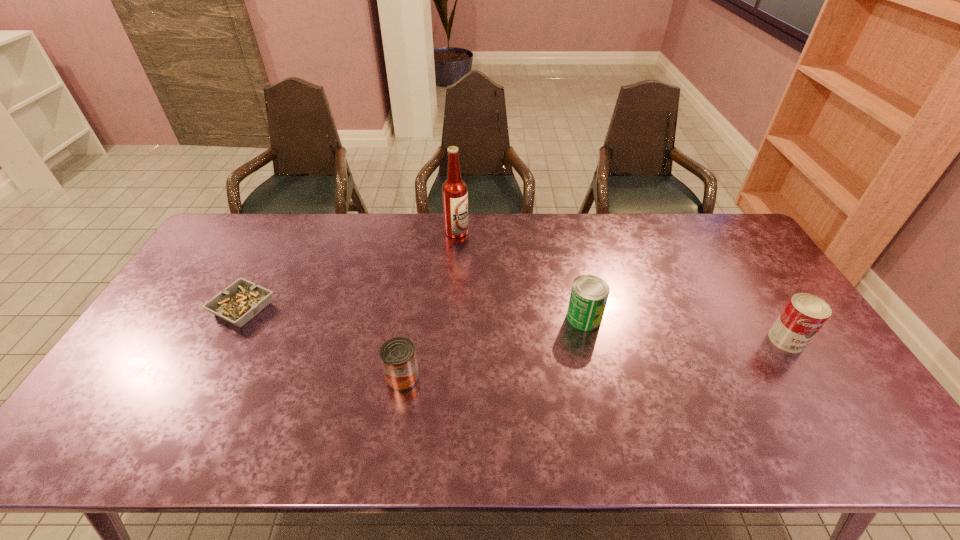
The width and height of the screenshot is (960, 540). What are the coordinates of `blank region between the nearest can and the fourth object from left to right` in the screenshot? It's located at (493, 348).

You are a GUI agent. You are given a task and a screenshot of the screen. Output one action in this format:
    pyautogui.click(x=<x>, y=<y>)
    Task: Click on the empty space that is in between the leftmost can and the second can from right to left
    The height and width of the screenshot is (540, 960).
    Given the screenshot: What is the action you would take?
    pyautogui.click(x=493, y=348)

Locate an element on the screen. The width and height of the screenshot is (960, 540). free space between the rightmost object and the nearest object is located at coordinates (594, 359).

At what (x,y) coordinates should I click in order to perform the action: click on the fourth closest object to the rightmost can. Please return your answer as a coordinate pair (x, y). This screenshot has height=540, width=960. Looking at the image, I should click on click(242, 300).

At what (x,y) coordinates should I click in order to perform the action: click on object that is the second closest to the tallest object. Please return your answer as a coordinate pair (x, y). The height and width of the screenshot is (540, 960). Looking at the image, I should click on (398, 356).

At what (x,y) coordinates should I click in order to perform the action: click on can that stands as the third closest to the ashtray. Please return your answer as a coordinate pair (x, y). The image size is (960, 540). Looking at the image, I should click on [804, 314].

Where is `can object that ranks as the second closest to the farthest object`? can object that ranks as the second closest to the farthest object is located at coordinates (398, 356).

In order to click on vacant space that satisfies the following two spatial constraints: 1. on the label side of the third object from right to left; 2. on the left side of the fourth object from left to right in this screenshot , I will do `click(451, 318)`.

The image size is (960, 540). Find the location of `free space in the image that satisfies the following two spatial constraints: 1. on the label side of the second object from right to left; 2. on the right side of the alcohol`. free space in the image that satisfies the following two spatial constraints: 1. on the label side of the second object from right to left; 2. on the right side of the alcohol is located at coordinates (451, 318).